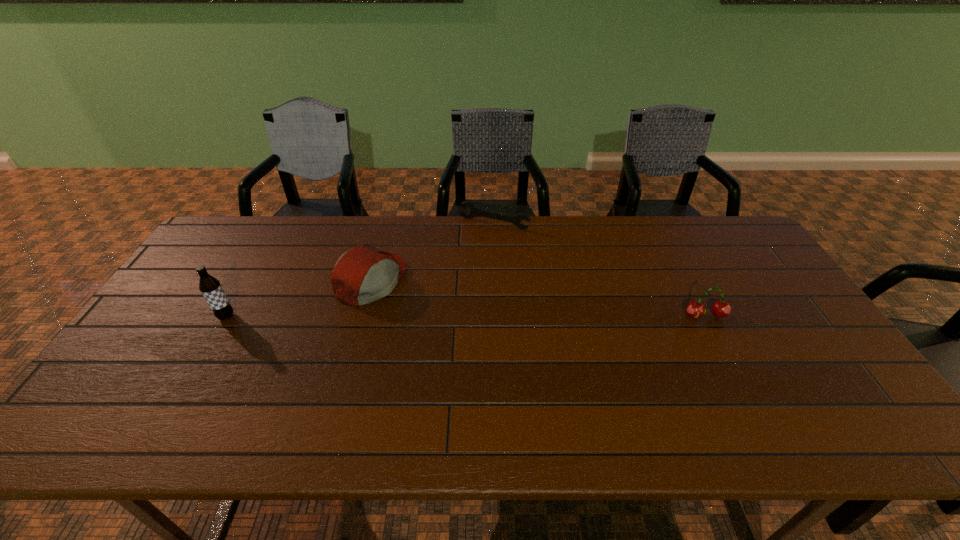
Find the location of a particular element. free space on the desktop that is between the tallest object and the cherry and is positioned on the front-facing side of the third object from right to left is located at coordinates 452,316.

What are the coordinates of `free spot on the desktop that is between the root beer and the rightmost object and is positioned on the open ends of the farthest object` in the screenshot? It's located at (440, 316).